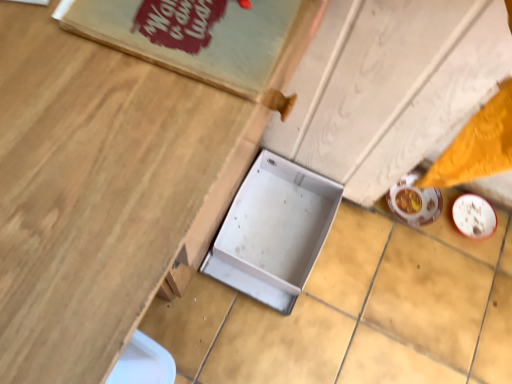
Question: Considering the positions of metallic silver box at center and metallic silver tray at center in the image, is metallic silver box at center wider or thinner than metallic silver tray at center?

Choices:
 (A) wide
 (B) thin

Answer: (B)

Question: In terms of height, does metallic silver box at center look taller or shorter compared to metallic silver tray at center?

Choices:
 (A) short
 (B) tall

Answer: (A)

Question: Relative to metallic silver tray at center, is metallic silver box at center in front or behind?

Choices:
 (A) behind
 (B) front

Answer: (A)

Question: Is point (153, 160) closer or farther from the camera than point (314, 223)?

Choices:
 (A) closer
 (B) farther

Answer: (A)

Question: Considering their positions, is metallic silver tray at center located in front of or behind metallic silver box at center?

Choices:
 (A) behind
 (B) front

Answer: (B)

Question: From a real-world perspective, is metallic silver tray at center physically located above or below metallic silver box at center?

Choices:
 (A) above
 (B) below

Answer: (A)

Question: In terms of size, does metallic silver tray at center appear bigger or smaller than metallic silver box at center?

Choices:
 (A) big
 (B) small

Answer: (A)